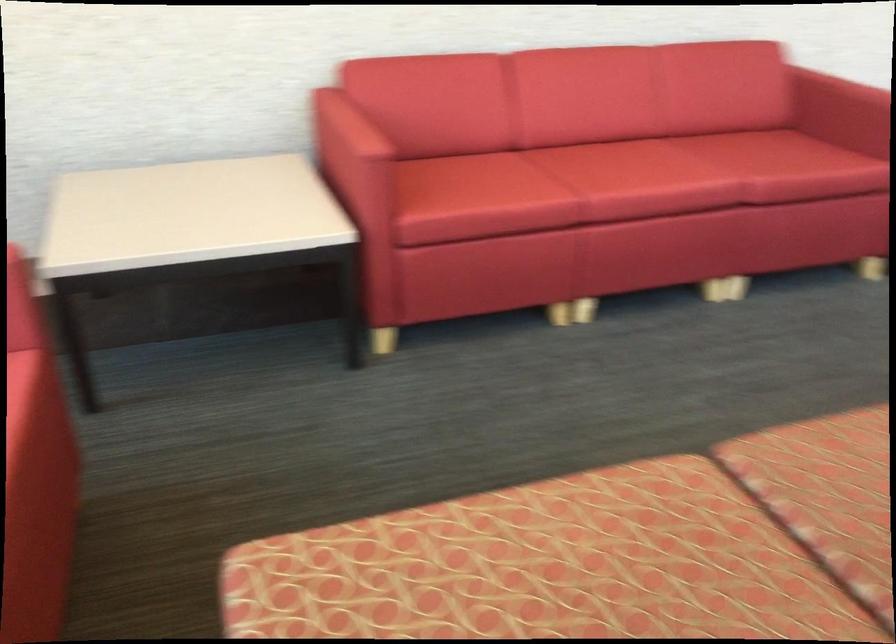
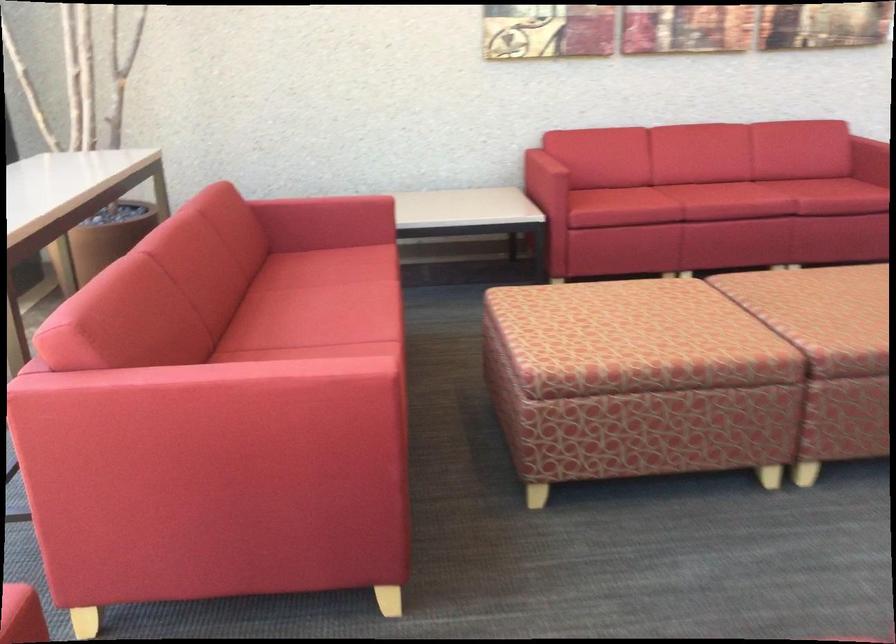
Find the pixel in the second image that matches pixel 658 201 in the first image.

(725, 201)